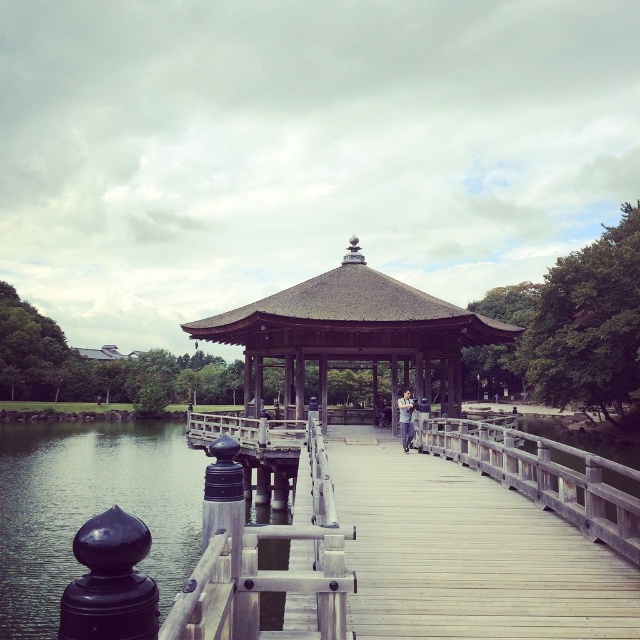
Question: Among these objects, which one is nearest to the camera?

Choices:
 (A) wooden at center
 (B) brown wooden gazebo at center

Answer: (A)

Question: Is brown wooden gazebo at center below wooden at center?

Choices:
 (A) no
 (B) yes

Answer: (A)

Question: Which of the following is the closest to the observer?

Choices:
 (A) (285, 378)
 (B) (609, 481)

Answer: (B)

Question: Is brown wooden gazebo at center further to camera compared to wooden at center?

Choices:
 (A) no
 (B) yes

Answer: (B)

Question: Which of the following is the closest to the observer?

Choices:
 (A) (273, 352)
 (B) (612, 545)

Answer: (B)

Question: Can you confirm if brown wooden gazebo at center is positioned to the left of wooden at center?

Choices:
 (A) no
 (B) yes

Answer: (B)